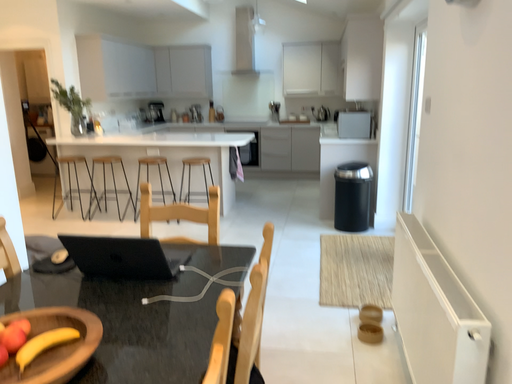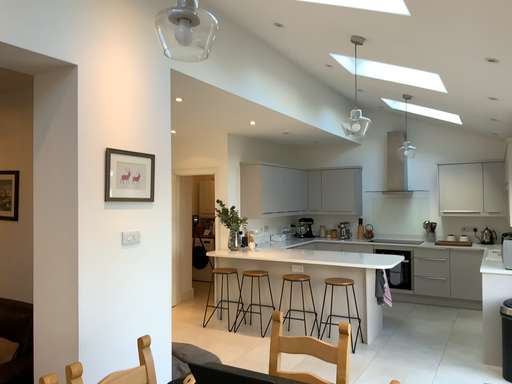
Question: How did the camera likely rotate when shooting the video?

Choices:
 (A) rotated left
 (B) rotated right

Answer: (A)